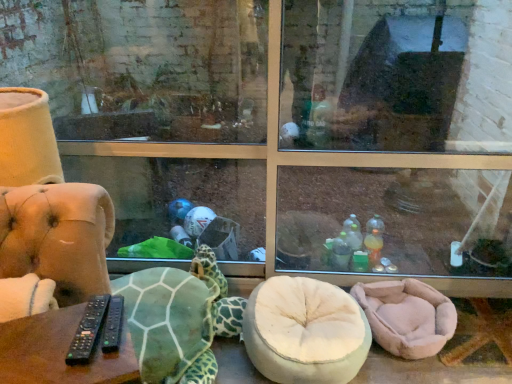
This screenshot has width=512, height=384. What do you see at coordinates (407, 316) in the screenshot? I see `pink plush bean bag at lower right` at bounding box center [407, 316].

Measure the distance between black plastic remotes at lower left and camera.

black plastic remotes at lower left is 31.34 inches from camera.

Identify the location of pink plush bean bag at lower right. The width and height of the screenshot is (512, 384). (407, 316).

Can you confirm if black plastic remotes at lower left is taller than green textured fabric tortoise at lower left?

Yes.

From a real-world perspective, who is located higher, black plastic remotes at lower left or green textured fabric tortoise at lower left?

black plastic remotes at lower left.

Choose the correct answer: Is black plastic remotes at lower left inside green textured fabric tortoise at lower left or outside it?

black plastic remotes at lower left is not inside green textured fabric tortoise at lower left, it's outside.

From the picture: From the image's perspective, is pink plush bean bag at lower right over green textured fabric tortoise at lower left?

No, from the image's perspective, pink plush bean bag at lower right is not above green textured fabric tortoise at lower left.

Are pink plush bean bag at lower right and green textured fabric tortoise at lower left beside each other?

No, pink plush bean bag at lower right is not beside green textured fabric tortoise at lower left.

From a real-world perspective, is pink plush bean bag at lower right physically located above or below green textured fabric tortoise at lower left?

pink plush bean bag at lower right is below green textured fabric tortoise at lower left.

How much distance is there between pink plush bean bag at lower right and green textured fabric tortoise at lower left?

pink plush bean bag at lower right and green textured fabric tortoise at lower left are 29.25 inches apart from each other.

From the image's perspective, who appears lower, green textured fabric tortoise at lower left or black plastic remotes at lower left?

green textured fabric tortoise at lower left appears lower in the image.

Based on the photo, which of these two, green textured fabric tortoise at lower left or black plastic remotes at lower left, is bigger?

green textured fabric tortoise at lower left.

Is green textured fabric tortoise at lower left at the right side of black plastic remotes at lower left?

Yes.

In the scene shown: Considering the relative sizes of green textured fabric tortoise at lower left and black plastic remotes at lower left in the image provided, is green textured fabric tortoise at lower left thinner than black plastic remotes at lower left?

In fact, green textured fabric tortoise at lower left might be wider than black plastic remotes at lower left.

Between pink plush bean bag at lower right and black plastic remotes at lower left, which one has smaller width?

black plastic remotes at lower left.

How distant is pink plush bean bag at lower right from black plastic remotes at lower left?

A distance of 4.16 feet exists between pink plush bean bag at lower right and black plastic remotes at lower left.

Which is more distant, (x=371, y=309) or (x=14, y=377)?

The point (x=371, y=309) is behind.

Is pink plush bean bag at lower right to the left or to the right of black plastic remotes at lower left in the image?

In the image, pink plush bean bag at lower right appears on the right side of black plastic remotes at lower left.

At what (x,y) coordinates should I click in order to perform the action: click on bean bag chair behind the green textured fabric tortoise at lower left. Please return your answer as a coordinate pair (x, y). Image resolution: width=512 pixels, height=384 pixels. Looking at the image, I should click on pyautogui.click(x=407, y=316).

Does point (210, 374) come behind point (400, 317)?

That is False.

How different are the orientations of green textured fabric tortoise at lower left and pink plush bean bag at lower right in degrees?

The facing directions of green textured fabric tortoise at lower left and pink plush bean bag at lower right are 90 degrees apart.

Can you confirm if green textured fabric tortoise at lower left is shorter than pink plush bean bag at lower right?

In fact, green textured fabric tortoise at lower left may be taller than pink plush bean bag at lower right.

Looking at this image, is black plastic remotes at lower left with pink plush bean bag at lower right?

No, black plastic remotes at lower left is not next to pink plush bean bag at lower right.

Is point (58, 333) less distant than point (399, 285)?

That is True.

I want to click on bean bag chair on the right of the black plastic remotes at lower left, so click(x=407, y=316).

Who is smaller, black plastic remotes at lower left or pink plush bean bag at lower right?

Smaller between the two is pink plush bean bag at lower right.

The height and width of the screenshot is (384, 512). I want to click on table in front of the green textured fabric tortoise at lower left, so click(x=58, y=352).

The image size is (512, 384). I want to click on tortoise lying on the left of pink plush bean bag at lower right, so click(179, 319).

When comparing their distances from pink plush bean bag at lower right, does black plastic remotes at lower left or green textured fabric tortoise at lower left seem closer?

The object closer to pink plush bean bag at lower right is green textured fabric tortoise at lower left.

Which object lies nearer to the anchor point green textured fabric tortoise at lower left, black plastic remotes at lower left or pink plush bean bag at lower right?

pink plush bean bag at lower right.

Based on their spatial positions, is pink plush bean bag at lower right or black plastic remotes at lower left closer to green textured fabric tortoise at lower left?

Based on the image, pink plush bean bag at lower right appears to be nearer to green textured fabric tortoise at lower left.

Which object lies further to the anchor point black plastic remotes at lower left, pink plush bean bag at lower right or green textured fabric tortoise at lower left?

Among the two, pink plush bean bag at lower right is located further to black plastic remotes at lower left.

Considering their positions, is green textured fabric tortoise at lower left positioned further to pink plush bean bag at lower right than black plastic remotes at lower left?

Based on the image, black plastic remotes at lower left appears to be further to pink plush bean bag at lower right.

Estimate the real-world distances between objects in this image. Which object is further from black plastic remotes at lower left, green textured fabric tortoise at lower left or pink plush bean bag at lower right?

pink plush bean bag at lower right.

At what (x,y) coordinates should I click in order to perform the action: click on tortoise between black plastic remotes at lower left and pink plush bean bag at lower right from left to right. Please return your answer as a coordinate pair (x, y). The image size is (512, 384). Looking at the image, I should click on (179, 319).